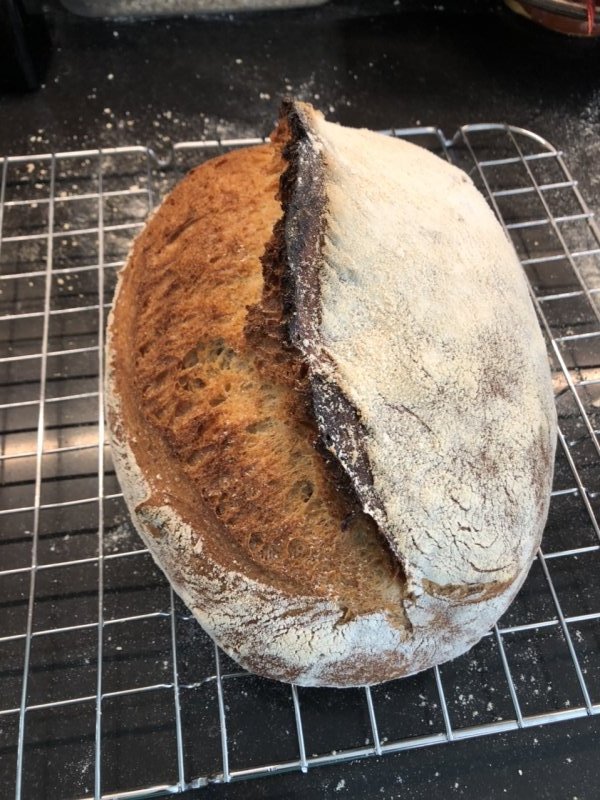
Where is `oven`? Image resolution: width=600 pixels, height=800 pixels. oven is located at coordinates (426, 54).